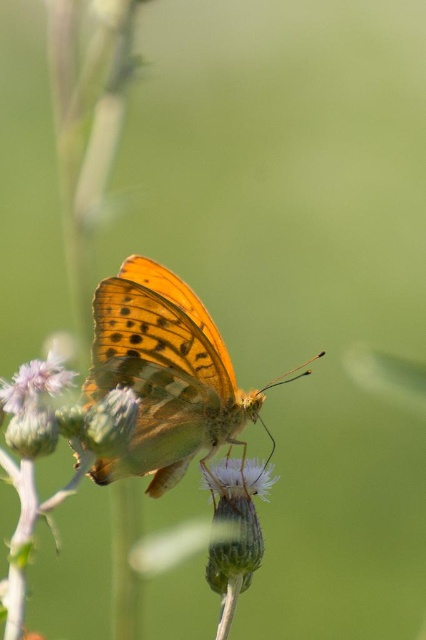
Which is above, orange translucent wings at center or white fuzzy flower at center?

orange translucent wings at center is higher up.

Who is more forward, (199, 404) or (224, 470)?

Point (199, 404)

Identify the location of orange translucent wings at center. Image resolution: width=426 pixels, height=640 pixels. (164, 374).

Is purple fuzzy flower at lower left shorter than white fuzzy flower at center?

In fact, purple fuzzy flower at lower left may be taller than white fuzzy flower at center.

Can you confirm if purple fuzzy flower at lower left is wider than white fuzzy flower at center?

In fact, purple fuzzy flower at lower left might be narrower than white fuzzy flower at center.

The width and height of the screenshot is (426, 640). Describe the element at coordinates (36, 381) in the screenshot. I see `purple fuzzy flower at lower left` at that location.

You are a GUI agent. You are given a task and a screenshot of the screen. Output one action in this format:
    pyautogui.click(x=<x>, y=<y>)
    Task: Click on the purple fuzzy flower at lower left
    This screenshot has height=640, width=426.
    Given the screenshot: What is the action you would take?
    pyautogui.click(x=36, y=381)

Is soft purple flower at center smaller than white fuzzy flower at center?

Correct, soft purple flower at center occupies less space than white fuzzy flower at center.

Is soft purple flower at center wider than white fuzzy flower at center?

No, soft purple flower at center is not wider than white fuzzy flower at center.

This screenshot has height=640, width=426. I want to click on soft purple flower at center, so click(x=111, y=420).